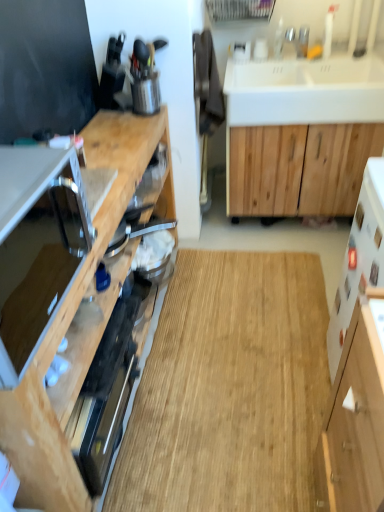
The image size is (384, 512). What are the coordinates of `free region on the left part of metallic silver utensil holder at upper left, the 1th appliance in the back-to-front sequence` in the screenshot? It's located at (117, 117).